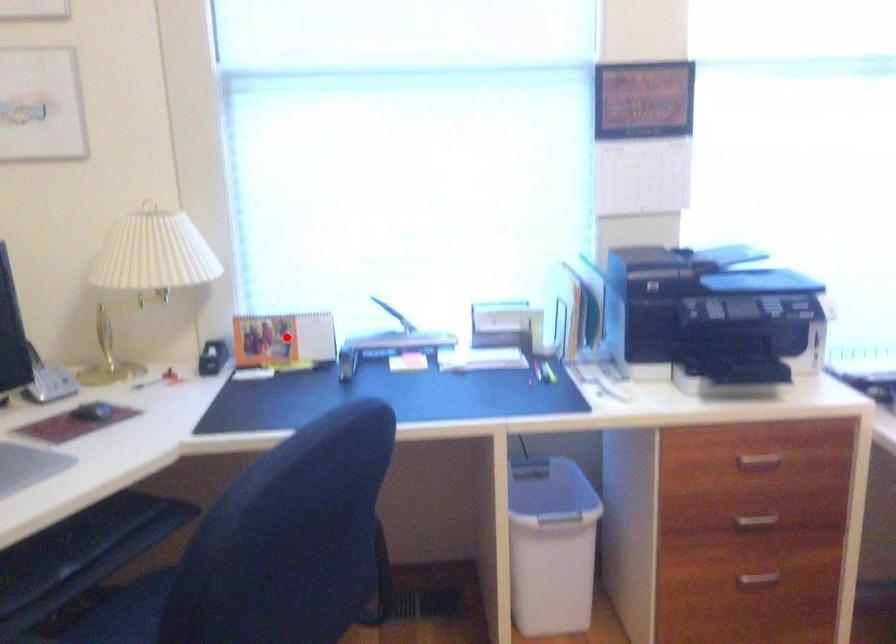
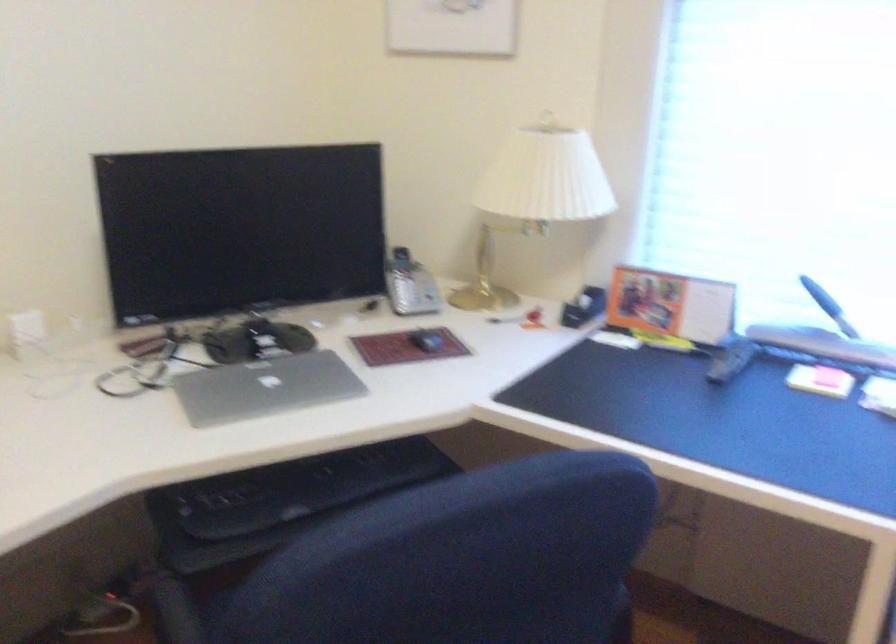
Where in the second image is the point corresponding to the highlighted location from the first image?

(670, 305)